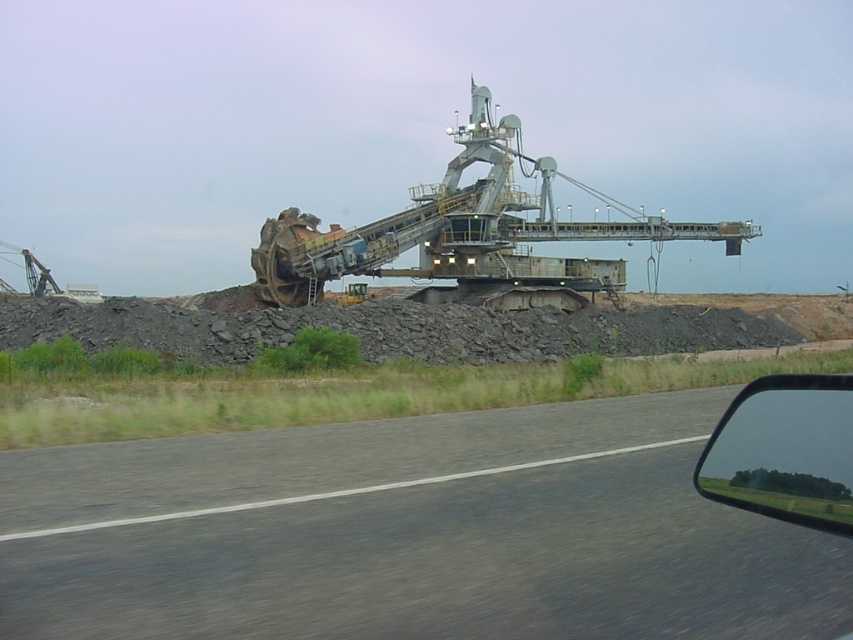
You are a passenger in the car and looking out the transparent glass car window at lower right. Can you see the gray asphalt road at center through the window?

Yes, because the gray asphalt road at center is positioned under the transparent glass car window at lower right, so it is directly below the window and visible from inside the car.

You are sitting in the driver seat of the vehicle and want to check two points on the road ahead. The first point is at coordinates point (674, 556) and the second is at point (782, 397). Which point is closer to your current position?

Point (782, 397) is closer to your current position because it is less further to the camera than point (674, 556).